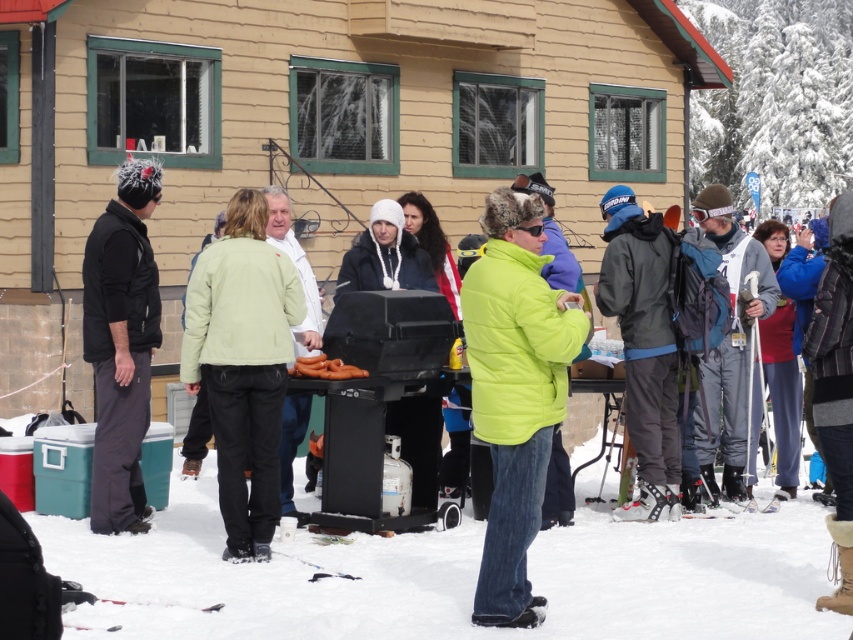
You are standing at the edge of the snowy area and want to reach the wooden cabin. There is white fluffy snow at lower center and green puffy jacket at center in your way. Which object is closer to you?

The white fluffy snow at lower center is closer to you since it is positioned below the green puffy jacket at center, meaning it is nearer in the scene.

Looking at this image, you are a photographer trying to capture a clear photo of the brown matte hot dogs at center and the green puffy jacket at center. Since the grill is emitting smoke, which object might appear more blurred in the photo due to its size? Please explain your reasoning.

The green puffy jacket at center is larger in size than the brown matte hot dogs at center. Therefore, the green puffy jacket at center might appear more blurred in the photo because larger objects are more likely to be affected by motion blur if they occupy more of the frame, especially in a smoky environment where visibility is reduced.

You are standing at the edge of the snowy area and need to reach the green puffy jacket at center without stepping on the white fluffy snow at lower center. Is this possible given the distance provided?

The distance between the white fluffy snow at lower center and the green puffy jacket at center is 2.27 meters. Since you can move around the snow area, it is possible to reach the jacket without stepping on the snow by going around the 2.27 meters distance.